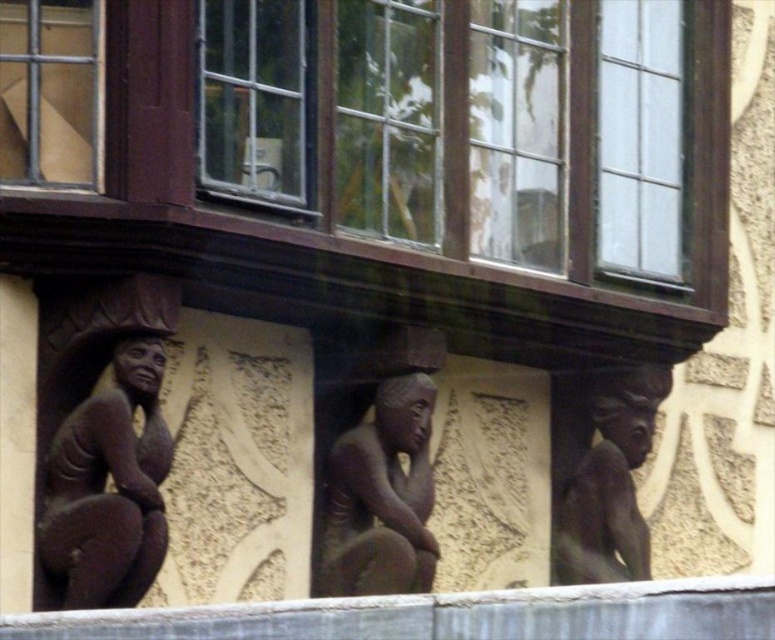
You are a window cleaner standing at the base of the building. You need to clean the clear glass window at upper center and the brown stone figure at right. Given that your ladder can reach up to 50 feet, will you be able to clean both without moving the ladder?

The clear glass window at upper center and brown stone figure at right are 52.66 feet apart from each other, so the ladder can only reach up to 50 feet. Therefore, you will not be able to clean both without moving the ladder since the distance between them exceeds the ladder reach.

You are standing in front of a building and see the brown stone figure at left. If your camera is 50 meters away from the figure, can you take a clear photo of it without moving closer?

The brown stone figure at left and camera are 47.12 meters apart, so since the camera is only 47.12 meters away, which is within the 50 meters limit, you can take a clear photo without moving closer.

You are standing in front of the building and notice a point marked at coordinates (381,497). Which object from the scene does this point correspond to?

The point at coordinates (381,497) corresponds to the brown stone figure at center.